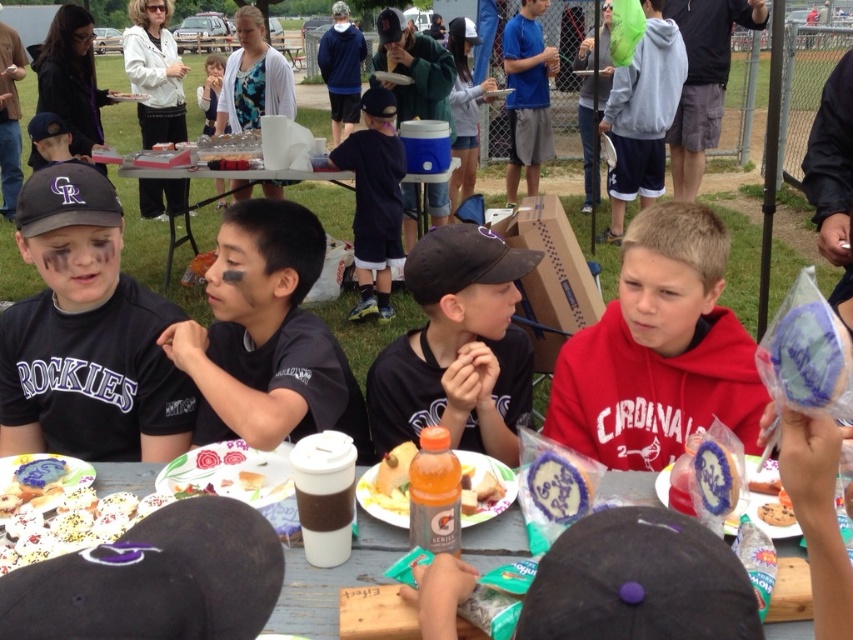
Is black matte shirt at center positioned behind decorated cookie at center?

Yes.

Based on the photo, is black matte shirt at center to the right of decorated cookie at center from the viewer's perspective?

→ Correct, you'll find black matte shirt at center to the right of decorated cookie at center.

What do you see at coordinates (265, 337) in the screenshot?
I see `black matte shirt at center` at bounding box center [265, 337].

Image resolution: width=853 pixels, height=640 pixels. In order to click on black matte shirt at center in this screenshot , I will do tap(265, 337).

Between black matte baseball cap at left and red matte hoodie at right, which one is positioned lower?

red matte hoodie at right is lower down.

Is point (160, 314) positioned in front of point (657, 362)?

That is False.

Where is `black matte baseball cap at left`? The width and height of the screenshot is (853, 640). black matte baseball cap at left is located at coordinates click(86, 333).

Is point (83, 522) more distant than point (784, 516)?

No, (83, 522) is closer to viewer.

Between point (55, 461) and point (775, 522), which one is positioned in front?

Positioned in front is point (775, 522).

Which is in front, point (103, 506) or point (762, 506)?

Positioned in front is point (762, 506).

Identify the location of decorated cookie at center. This screenshot has width=853, height=640. (61, 509).